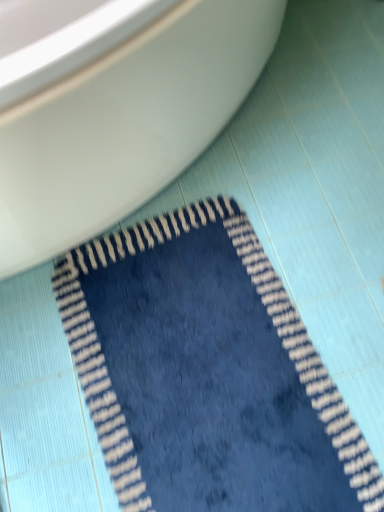
Describe the element at coordinates (125, 125) in the screenshot. This screenshot has height=512, width=384. I see `white glossy toilet at upper left` at that location.

Where is `white glossy toilet at upper left`? The height and width of the screenshot is (512, 384). white glossy toilet at upper left is located at coordinates (125, 125).

What do you see at coordinates (206, 372) in the screenshot? I see `navy blue plush rug at lower center` at bounding box center [206, 372].

Locate an element on the screen. The width and height of the screenshot is (384, 512). navy blue plush rug at lower center is located at coordinates (206, 372).

Locate an element on the screen. This screenshot has width=384, height=512. white glossy toilet at upper left is located at coordinates (125, 125).

Which is more to the right, navy blue plush rug at lower center or white glossy toilet at upper left?

navy blue plush rug at lower center.

Relative to white glossy toilet at upper left, is navy blue plush rug at lower center in front or behind?

Visually, navy blue plush rug at lower center is located behind white glossy toilet at upper left.

Which is behind, point (306, 416) or point (130, 44)?

Point (306, 416)

From the image's perspective, is navy blue plush rug at lower center on white glossy toilet at upper left?

No, from the image's perspective, navy blue plush rug at lower center is not over white glossy toilet at upper left.

From a real-world perspective, is navy blue plush rug at lower center positioned over white glossy toilet at upper left based on gravity?

No, from a real-world perspective, navy blue plush rug at lower center is not on top of white glossy toilet at upper left.

Can you confirm if navy blue plush rug at lower center is thinner than white glossy toilet at upper left?

Correct, the width of navy blue plush rug at lower center is less than that of white glossy toilet at upper left.

Between navy blue plush rug at lower center and white glossy toilet at upper left, which one has less height?

Standing shorter between the two is navy blue plush rug at lower center.

Considering the sizes of objects navy blue plush rug at lower center and white glossy toilet at upper left in the image provided, who is bigger, navy blue plush rug at lower center or white glossy toilet at upper left?

white glossy toilet at upper left.

Is navy blue plush rug at lower center positioned beyond the bounds of white glossy toilet at upper left?

Absolutely, navy blue plush rug at lower center is external to white glossy toilet at upper left.

Is navy blue plush rug at lower center positioned far away from white glossy toilet at upper left?

That's not correct — navy blue plush rug at lower center is a little close to white glossy toilet at upper left.

Is navy blue plush rug at lower center facing away from white glossy toilet at upper left?

No, navy blue plush rug at lower center is not facing the opposite direction of white glossy toilet at upper left.

The height and width of the screenshot is (512, 384). Find the location of `toilet in front of the navy blue plush rug at lower center`. toilet in front of the navy blue plush rug at lower center is located at coordinates (125, 125).

Does white glossy toilet at upper left appear on the right side of navy blue plush rug at lower center?

No, white glossy toilet at upper left is not to the right of navy blue plush rug at lower center.

Who is more distant, white glossy toilet at upper left or navy blue plush rug at lower center?

navy blue plush rug at lower center is further away from the camera.

Is point (93, 158) farther from viewer compared to point (181, 346)?

That is False.

From the image's perspective, which is above, white glossy toilet at upper left or navy blue plush rug at lower center?

white glossy toilet at upper left is shown above in the image.

From a real-world perspective, between white glossy toilet at upper left and navy blue plush rug at lower center, who is vertically higher?

white glossy toilet at upper left is physically above.

In the scene shown: Considering the sizes of objects white glossy toilet at upper left and navy blue plush rug at lower center in the image provided, who is thinner, white glossy toilet at upper left or navy blue plush rug at lower center?

Thinner between the two is navy blue plush rug at lower center.

Is white glossy toilet at upper left taller or shorter than navy blue plush rug at lower center?

Clearly, white glossy toilet at upper left is taller compared to navy blue plush rug at lower center.

Between white glossy toilet at upper left and navy blue plush rug at lower center, which one has smaller size?

Smaller between the two is navy blue plush rug at lower center.

Would you say white glossy toilet at upper left is outside navy blue plush rug at lower center?

That's correct, white glossy toilet at upper left is outside of navy blue plush rug at lower center.

Is white glossy toilet at upper left not near navy blue plush rug at lower center?

white glossy toilet at upper left is near navy blue plush rug at lower center, not far away.

Could you tell me if white glossy toilet at upper left is turned towards navy blue plush rug at lower center?

Result: Yes, white glossy toilet at upper left faces towards navy blue plush rug at lower center.

Measure the distance from white glossy toilet at upper left to navy blue plush rug at lower center.

white glossy toilet at upper left and navy blue plush rug at lower center are 16.40 inches apart.

Where is `doormat on the right side of white glossy toilet at upper left`? The height and width of the screenshot is (512, 384). doormat on the right side of white glossy toilet at upper left is located at coordinates (206, 372).

At what (x,y) coordinates should I click in order to perform the action: click on doormat below the white glossy toilet at upper left (from the image's perspective). Please return your answer as a coordinate pair (x, y). This screenshot has width=384, height=512. Looking at the image, I should click on (206, 372).

Where is `toilet lying in front of the navy blue plush rug at lower center`? toilet lying in front of the navy blue plush rug at lower center is located at coordinates (125, 125).